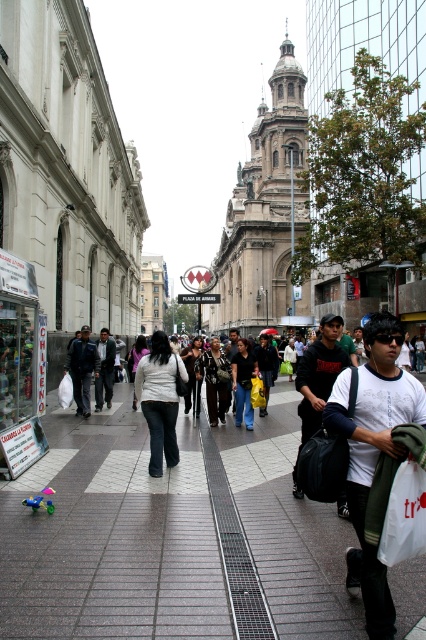
Can you confirm if dark gray jeans at center is shorter than dark gray pants at left?

In fact, dark gray jeans at center may be taller than dark gray pants at left.

Can you confirm if dark gray jeans at center is taller than dark gray pants at left?

Correct, dark gray jeans at center is much taller as dark gray pants at left.

Find the location of a particular element. Image resolution: width=426 pixels, height=640 pixels. dark gray jeans at center is located at coordinates (160, 401).

This screenshot has height=640, width=426. What are the coordinates of `dark gray jeans at center` in the screenshot? It's located at (160, 401).

Who is positioned more to the right, white cotton shirt at center or dark gray jeans at center?

From the viewer's perspective, white cotton shirt at center appears more on the right side.

Does white cotton shirt at center appear on the left side of dark gray jeans at center?

Incorrect, white cotton shirt at center is not on the left side of dark gray jeans at center.

Locate an element on the screen. This screenshot has height=640, width=426. white cotton shirt at center is located at coordinates (373, 452).

Between gray concrete sidewalk at center and white cotton shirt at center, which one appears on the left side from the viewer's perspective?

Positioned to the left is gray concrete sidewalk at center.

Is point (8, 589) farther from camera compared to point (356, 502)?

No, (8, 589) is closer to viewer.

The height and width of the screenshot is (640, 426). I want to click on gray concrete sidewalk at center, so pos(169,534).